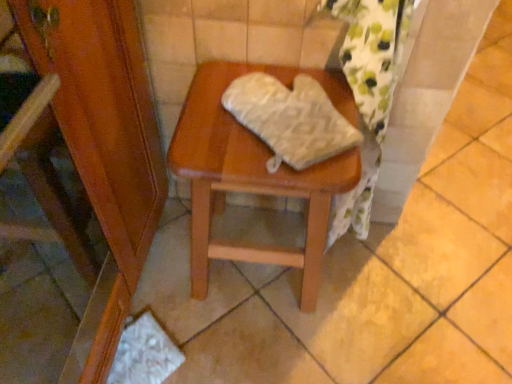
Question: Is white textured oven mitt at center spatially inside wooden stool at center, or outside of it?

Choices:
 (A) inside
 (B) outside

Answer: (B)

Question: In terms of width, does white textured oven mitt at center look wider or thinner when compared to wooden stool at center?

Choices:
 (A) wide
 (B) thin

Answer: (B)

Question: Does point (239, 94) appear closer or farther from the camera than point (256, 256)?

Choices:
 (A) farther
 (B) closer

Answer: (B)

Question: In terms of size, does wooden stool at center appear bigger or smaller than white textured oven mitt at center?

Choices:
 (A) big
 (B) small

Answer: (A)

Question: Choose the correct answer: Is wooden stool at center inside white textured oven mitt at center or outside it?

Choices:
 (A) outside
 (B) inside

Answer: (A)

Question: Is wooden stool at center to the left or to the right of white textured oven mitt at center in the image?

Choices:
 (A) right
 (B) left

Answer: (B)

Question: Considering their positions, is wooden stool at center located in front of or behind white textured oven mitt at center?

Choices:
 (A) front
 (B) behind

Answer: (B)